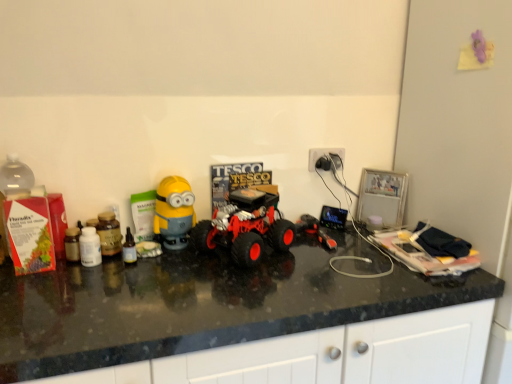
Describe the element at coordinates (174, 213) in the screenshot. This screenshot has height=384, width=512. I see `yellow matte minion toy at center-left, arranged as the third toy when viewed from the right` at that location.

Where is `white plastic plug at upper right`? The width and height of the screenshot is (512, 384). white plastic plug at upper right is located at coordinates (323, 155).

Image resolution: width=512 pixels, height=384 pixels. What do you see at coordinates (323, 155) in the screenshot?
I see `white plastic plug at upper right` at bounding box center [323, 155].

Measure the distance between black glossy countertop at center and camera.

The distance of black glossy countertop at center from camera is 33.57 inches.

This screenshot has height=384, width=512. Find the location of `translucent glass bottle at center`. translucent glass bottle at center is located at coordinates (129, 248).

Which is less distant, (x=335, y=247) or (x=243, y=273)?

Point (x=243, y=273)

Does rubberized black toy truck at center, placed as the first toy when sorted from right to left, have a greater height compared to black glossy countertop at center?

In fact, rubberized black toy truck at center, placed as the first toy when sorted from right to left, may be shorter than black glossy countertop at center.

Based on their sizes in the image, would you say rubberized black toy truck at center, placed as the first toy when sorted from right to left, is bigger or smaller than black glossy countertop at center?

In the image, rubberized black toy truck at center, placed as the first toy when sorted from right to left, appears to be smaller than black glossy countertop at center.

Could you tell me if rubberized black toy truck at center, placed as the first toy when sorted from right to left, is turned towards black glossy countertop at center?

No, rubberized black toy truck at center, placed as the first toy when sorted from right to left, is not oriented towards black glossy countertop at center.

Does rubberized red monster truck at center, which is counted as the second toy, starting from the left, have a greater width compared to translucent glass bottle at center?

Yes.

From a real-world perspective, which is physically below, rubberized red monster truck at center, which is counted as the second toy, starting from the left, or translucent glass bottle at center?

In real-world perspective, translucent glass bottle at center is lower.

Between rubberized red monster truck at center, which is counted as the second toy, starting from the left, and translucent glass bottle at center, which one has smaller size?

translucent glass bottle at center is smaller.

Is rubberized red monster truck at center, which is counted as the second toy, starting from the left, facing towards translucent glass bottle at center?

No, rubberized red monster truck at center, which is counted as the second toy, starting from the left, is not aimed at translucent glass bottle at center.

From the image's perspective, is rubberized red monster truck at center, the 2th toy viewed from the right, located above or below white plastic plug at upper right?

rubberized red monster truck at center, the 2th toy viewed from the right, is situated lower than white plastic plug at upper right in the image.

Is rubberized red monster truck at center, the 2th toy viewed from the right, to the right of white plastic plug at upper right from the viewer's perspective?

No, rubberized red monster truck at center, the 2th toy viewed from the right, is not to the right of white plastic plug at upper right.

Is point (227, 244) positioned after point (335, 151)?

No.

Does rubberized red monster truck at center, which is counted as the second toy, starting from the left, have a larger size compared to white plastic plug at upper right?

Indeed, rubberized red monster truck at center, which is counted as the second toy, starting from the left, has a larger size compared to white plastic plug at upper right.

Is translucent glass bottle at center with rubberized red monster truck at center, which is counted as the second toy, starting from the left?

translucent glass bottle at center and rubberized red monster truck at center, which is counted as the second toy, starting from the left, are clearly separated.

Looking at this image, is translucent glass bottle at center closer to camera compared to rubberized red monster truck at center, the 2th toy viewed from the right?

No, translucent glass bottle at center is further to the viewer.

Is translucent glass bottle at center not within rubberized red monster truck at center, the 2th toy viewed from the right?

translucent glass bottle at center lies outside rubberized red monster truck at center, the 2th toy viewed from the right,'s area.

Image resolution: width=512 pixels, height=384 pixels. What are the coordinates of `the 2nd toy to the right when counting from the translucent glass bottle at center` in the screenshot? It's located at (246, 226).

Is black glossy countertop at center facing towards white plastic plug at upper right?

No, black glossy countertop at center does not turn towards white plastic plug at upper right.

From a real-world perspective, is black glossy countertop at center on white plastic plug at upper right?

Incorrect, from a real-world perspective, black glossy countertop at center is lower than white plastic plug at upper right.

Which is closer to the camera, (375,262) or (319,152)?

The point (375,262) is closer to the camera.

Based on the photo, could you tell me if translucent glass bottle at center is turned towards yellow matte minion toy at center-left, which ranks as the 1th toy in left-to-right order?

No, translucent glass bottle at center is not aimed at yellow matte minion toy at center-left, which ranks as the 1th toy in left-to-right order.

From a real-world perspective, is translucent glass bottle at center above or below yellow matte minion toy at center-left, arranged as the third toy when viewed from the right?

translucent glass bottle at center is situated lower than yellow matte minion toy at center-left, arranged as the third toy when viewed from the right, in the real world.

Is point (128, 259) more distant than point (182, 225)?

No, it is in front of (182, 225).

This screenshot has height=384, width=512. What are the coordinates of `bottle above the rubberized black toy truck at center, placed as the first toy when sorted from right to left (from a real-world perspective)` in the screenshot? It's located at (129, 248).

Is rubberized black toy truck at center, arranged as the 3th toy when viewed from the left, thinner than translucent glass bottle at center?

No, rubberized black toy truck at center, arranged as the 3th toy when viewed from the left, is not thinner than translucent glass bottle at center.

In the scene shown: Can you confirm if rubberized black toy truck at center, placed as the first toy when sorted from right to left, is shorter than translucent glass bottle at center?

Indeed, rubberized black toy truck at center, placed as the first toy when sorted from right to left, has a lesser height compared to translucent glass bottle at center.

The height and width of the screenshot is (384, 512). I want to click on countertop below the rubberized black toy truck at center, arranged as the 3th toy when viewed from the left (from the image's perspective), so click(x=197, y=305).

Locate an element on the screen. The height and width of the screenshot is (384, 512). bottle that appears below the rubberized red monster truck at center, the 2th toy viewed from the right (from a real-world perspective) is located at coordinates (129, 248).

Looking at the image, which one is located closer to black glossy countertop at center, rubberized black toy truck at center, arranged as the 3th toy when viewed from the left, or rubberized red monster truck at center, the 2th toy viewed from the right?

rubberized red monster truck at center, the 2th toy viewed from the right.

Consider the image. When comparing their distances from white plastic plug at upper right, does rubberized black toy truck at center, placed as the first toy when sorted from right to left, or black glossy countertop at center seem further?

black glossy countertop at center.

From the picture: Which object lies nearer to the anchor point rubberized black toy truck at center, arranged as the 3th toy when viewed from the left, rubberized red monster truck at center, the 2th toy viewed from the right, or translucent glass bottle at center?

Based on the image, rubberized red monster truck at center, the 2th toy viewed from the right, appears to be nearer to rubberized black toy truck at center, arranged as the 3th toy when viewed from the left.

When comparing their distances from rubberized red monster truck at center, which is counted as the second toy, starting from the left, does yellow matte minion toy at center-left, which ranks as the 1th toy in left-to-right order, or translucent glass bottle at center seem closer?

The object closer to rubberized red monster truck at center, which is counted as the second toy, starting from the left, is yellow matte minion toy at center-left, which ranks as the 1th toy in left-to-right order.

Based on their spatial positions, is translucent glass bottle at center or rubberized red monster truck at center, the 2th toy viewed from the right, further from white plastic plug at upper right?

translucent glass bottle at center is positioned further to the anchor white plastic plug at upper right.

From the image, which object appears to be nearer to white plastic plug at upper right, rubberized black toy truck at center, arranged as the 3th toy when viewed from the left, or translucent glass bottle at center?

Based on the image, rubberized black toy truck at center, arranged as the 3th toy when viewed from the left, appears to be nearer to white plastic plug at upper right.

Looking at the image, which one is located further to yellow matte minion toy at center-left, arranged as the third toy when viewed from the right, rubberized red monster truck at center, the 2th toy viewed from the right, or rubberized black toy truck at center, arranged as the 3th toy when viewed from the left?

rubberized black toy truck at center, arranged as the 3th toy when viewed from the left, is positioned further to the anchor yellow matte minion toy at center-left, arranged as the third toy when viewed from the right.

Looking at the image, which one is located closer to rubberized black toy truck at center, placed as the first toy when sorted from right to left, yellow matte minion toy at center-left, arranged as the third toy when viewed from the right, or white plastic plug at upper right?

The object closer to rubberized black toy truck at center, placed as the first toy when sorted from right to left, is white plastic plug at upper right.

What are the coordinates of `bottle between black glossy countertop at center and white plastic plug at upper right from front to back` in the screenshot? It's located at (129, 248).

The height and width of the screenshot is (384, 512). What are the coordinates of `bottle positioned between black glossy countertop at center and rubberized black toy truck at center, placed as the first toy when sorted from right to left, from near to far` in the screenshot? It's located at tap(129, 248).

This screenshot has width=512, height=384. Find the location of `toy between yellow matte minion toy at center-left, arranged as the third toy when viewed from the right, and rubberized black toy truck at center, placed as the first toy when sorted from right to left, from left to right`. toy between yellow matte minion toy at center-left, arranged as the third toy when viewed from the right, and rubberized black toy truck at center, placed as the first toy when sorted from right to left, from left to right is located at coordinates (246, 226).

The image size is (512, 384). In order to click on bottle between rubberized red monster truck at center, which is counted as the second toy, starting from the left, and black glossy countertop at center vertically in this screenshot , I will do `click(129, 248)`.